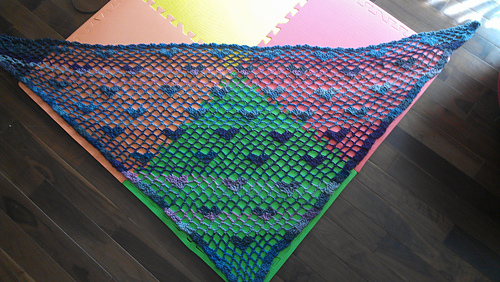
Locate an element on the screen. This screenshot has height=282, width=500. pink tile is located at coordinates (304, 25).